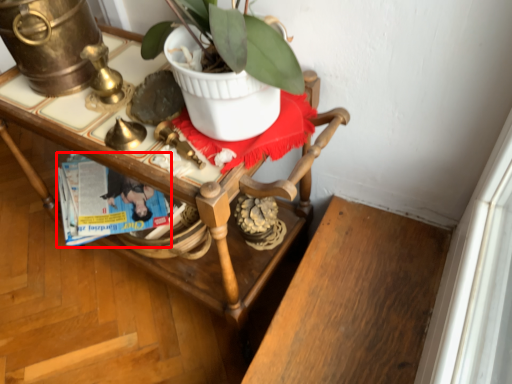
Question: From the image's perspective, where is magazine (annotated by the red box) located relative to desk?

Choices:
 (A) below
 (B) above

Answer: (B)